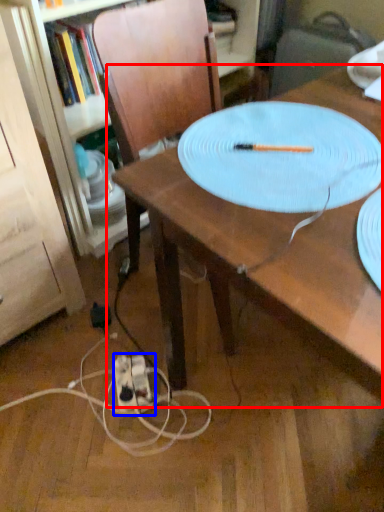
Question: Among these objects, which one is nearest to the camera, table (highlighted by a red box) or extension cord (highlighted by a blue box)?

Choices:
 (A) table
 (B) extension cord

Answer: (A)